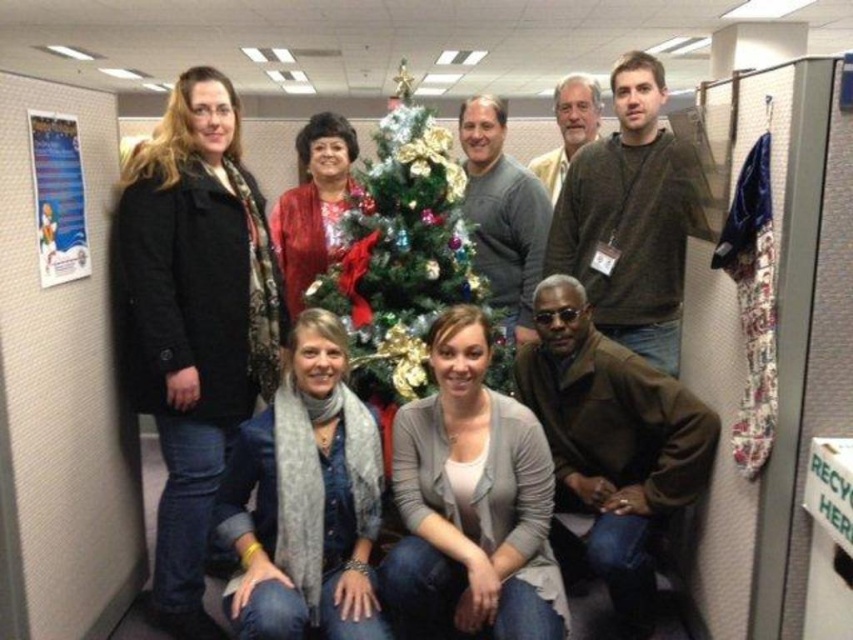
Who is higher up, gray scarf at lower center or brown cotton shirt at upper right?

brown cotton shirt at upper right

Who is more distant from viewer, (349, 484) or (654, 58)?

Point (654, 58)

You are a GUI agent. You are given a task and a screenshot of the screen. Output one action in this format:
    pyautogui.click(x=<x>, y=<y>)
    Task: Click on the gray scarf at lower center
    This screenshot has width=853, height=640.
    Given the screenshot: What is the action you would take?
    pyautogui.click(x=305, y=500)

Is black matte coat at left to the left of brown leather jacket at lower right from the viewer's perspective?

Correct, you'll find black matte coat at left to the left of brown leather jacket at lower right.

Which of these two, black matte coat at left or brown leather jacket at lower right, stands shorter?

brown leather jacket at lower right

Between point (265, 292) and point (606, 582), which one is positioned in front?

Point (606, 582) is in front.

I want to click on black matte coat at left, so click(x=194, y=321).

Does black matte coat at left have a smaller size compared to gray scarf at lower center?

Incorrect, black matte coat at left is not smaller in size than gray scarf at lower center.

Where is `black matte coat at left`? black matte coat at left is located at coordinates (194, 321).

Does point (262, 320) come in front of point (322, 474)?

No, it is behind (322, 474).

This screenshot has height=640, width=853. I want to click on black matte coat at left, so click(194, 321).